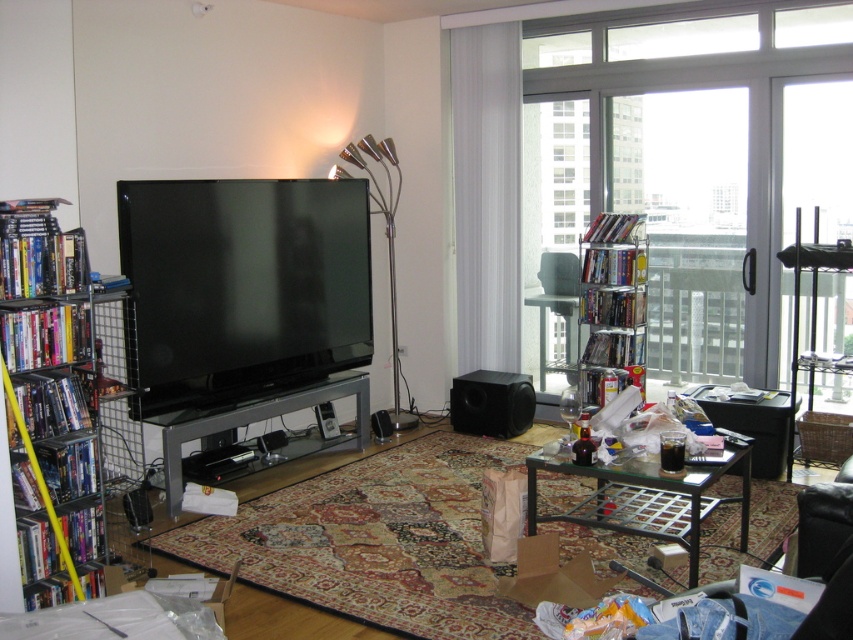
What are the coordinates of the black glossy flat screen tv at center?

The coordinates of the black glossy flat screen tv at center are at point (241, 289).

You are standing in the living room and want to pick up two items located at the coordinates point (126, 205) and point (178, 467). Which item should you reach for first to minimize the distance walked?

You should reach for the item at point (126, 205) first because it is closer to you than point (178, 467), so you can pick it up without moving further away.